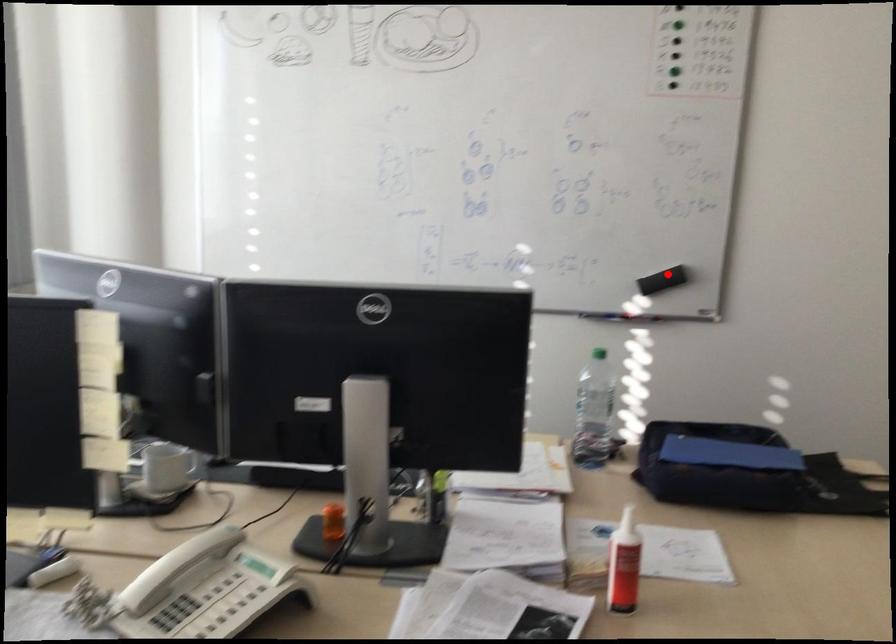
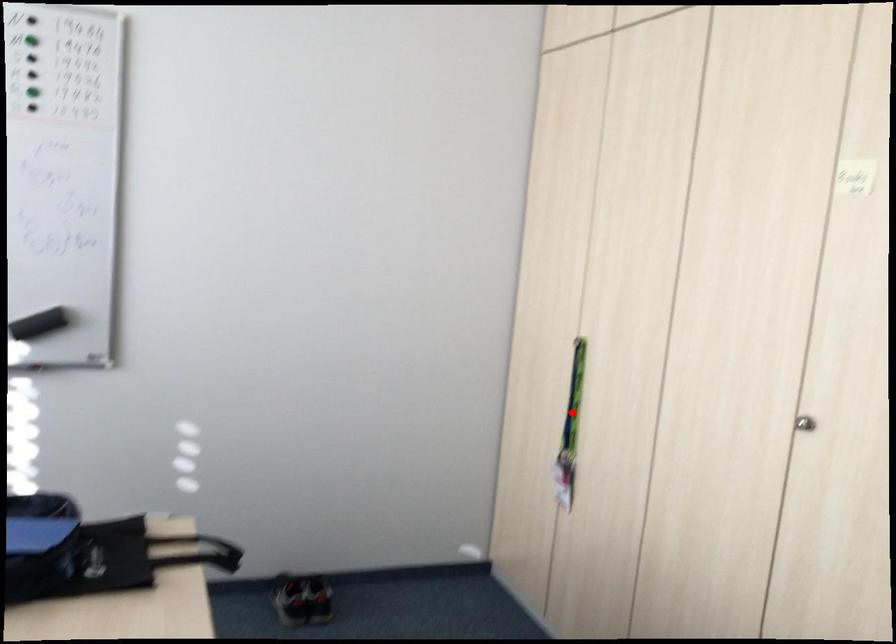
I am providing you with two images of the same scene from different viewpoints. A red point is marked on the first image and another point is marked on the second image. Does the point marked in image1 correspond to the same location as the one in image2?

No